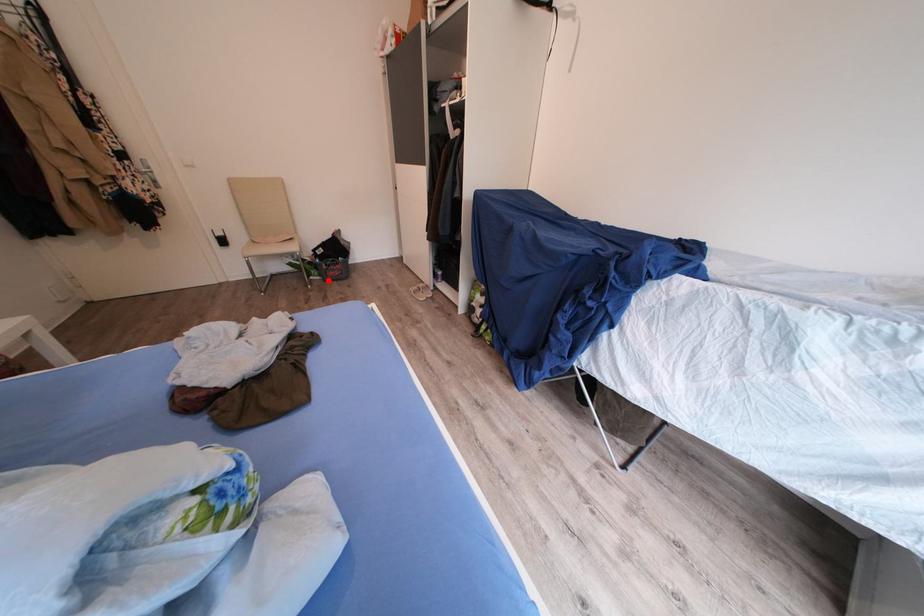
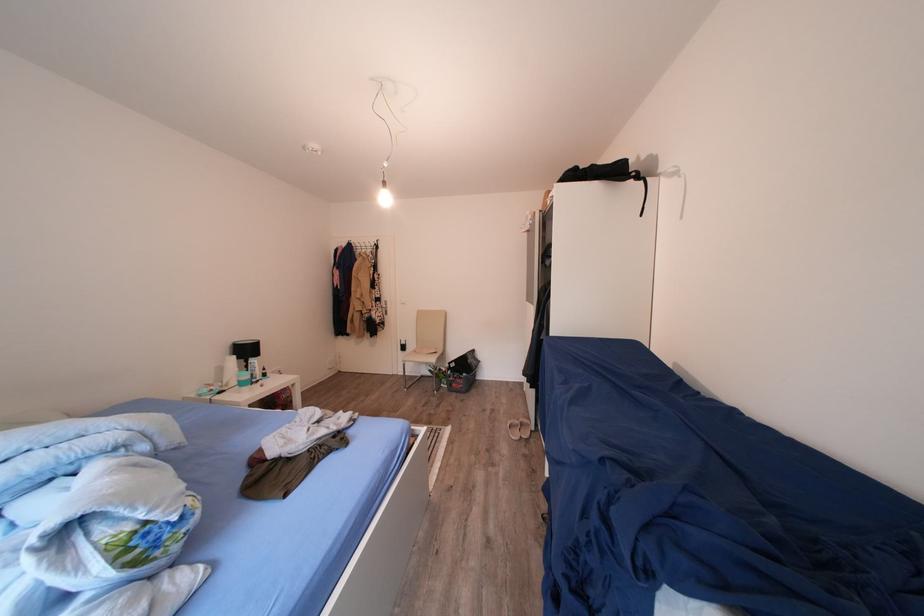
Question: I am providing you with two images of the same scene from different viewpoints. Given a red point in image1, look at the same physical point in image2. Is it:

Choices:
 (A) Closer to the viewpoint
 (B) Farther from the viewpoint

Answer: (B)